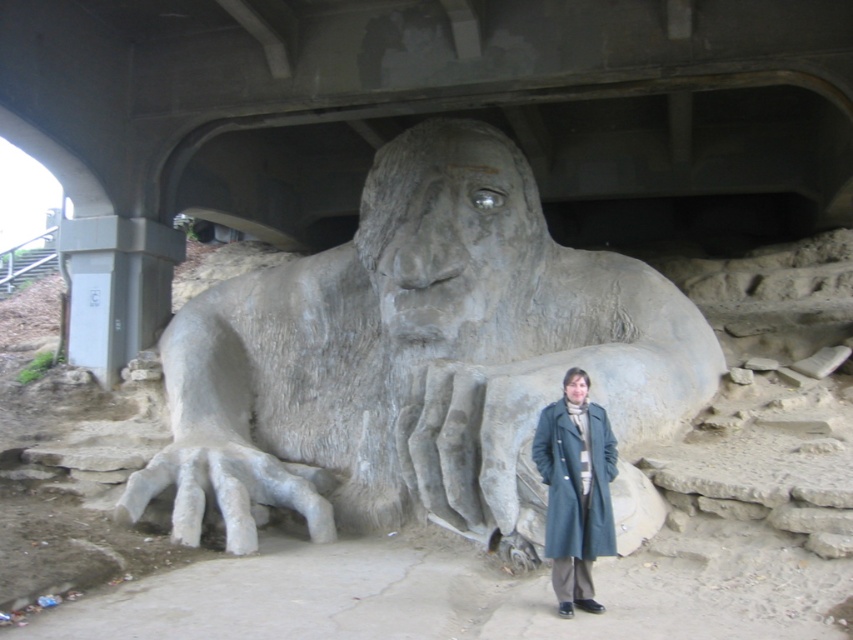
Consider the image. Who is positioned more to the left, gray stone statue at center or matte gray coat at lower right?

Positioned to the left is gray stone statue at center.

This screenshot has width=853, height=640. Describe the element at coordinates (413, 355) in the screenshot. I see `gray stone statue at center` at that location.

Where is `gray stone statue at center`? The width and height of the screenshot is (853, 640). gray stone statue at center is located at coordinates (413, 355).